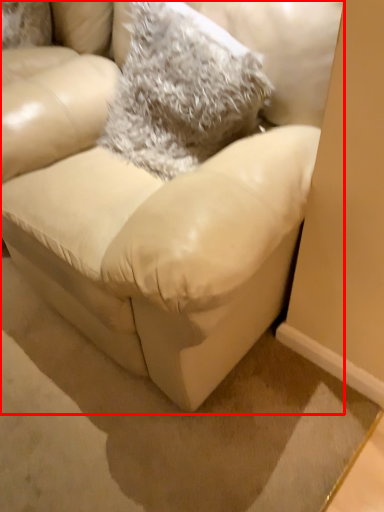
Question: Considering the relative positions of studio couch (annotated by the red box) and throw pillow in the image provided, where is studio couch (annotated by the red box) located with respect to the staircase?

Choices:
 (A) left
 (B) right

Answer: (A)